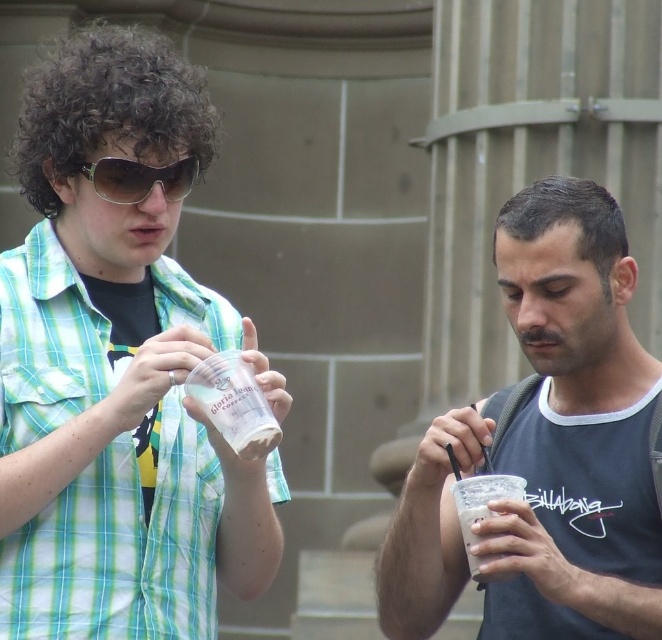
Who is taller, matte plastic cup at right or white frosted cup at right?

matte plastic cup at right is taller.

Is matte plastic cup at right above white frosted cup at right?

Yes.

Locate an element on the screen. The image size is (662, 640). matte plastic cup at right is located at coordinates (573, 429).

Who is positioned more to the right, translucent plastic cup at center or sunglasses at upper left?

Positioned to the right is sunglasses at upper left.

Who is more forward, (158, 452) or (164, 184)?

Point (158, 452) is in front.

Which is in front, point (99, 244) or point (140, 173)?

Point (140, 173) is more forward.

You are a GUI agent. You are given a task and a screenshot of the screen. Output one action in this format:
    pyautogui.click(x=<x>, y=<y>)
    Task: Click on the translucent plastic cup at center
    
    Given the screenshot: What is the action you would take?
    tap(118, 369)

Does white paper cup at center have a smaller size compared to white frosted cup at right?

No.

The height and width of the screenshot is (640, 662). Describe the element at coordinates (234, 403) in the screenshot. I see `white paper cup at center` at that location.

In order to click on white paper cup at center in this screenshot , I will do `click(234, 403)`.